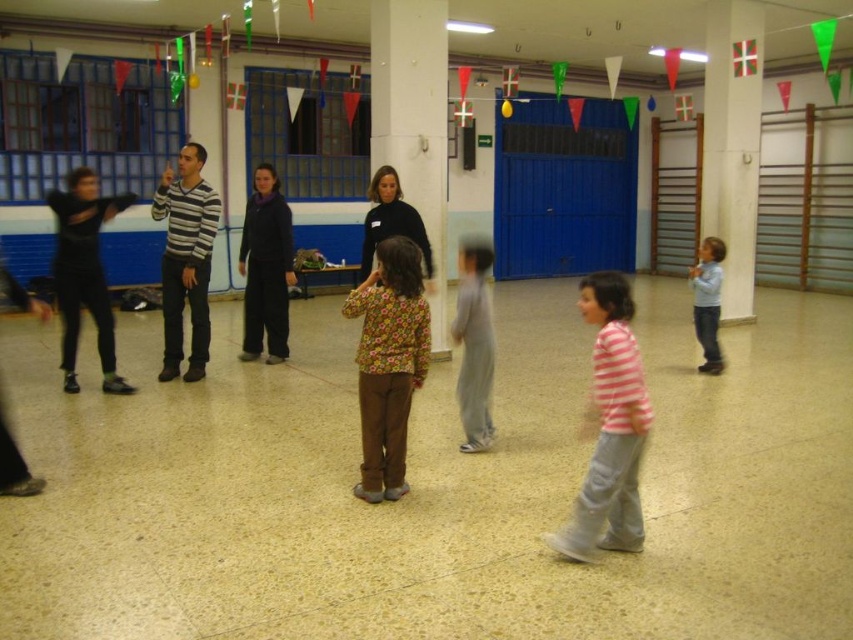
Is point (183, 150) positioned before point (697, 300)?

Yes, it is in front of point (697, 300).

In the scene shown: Which of these two, striped sweater at center or light blue cotton shirt at right, stands shorter?

Standing shorter between the two is light blue cotton shirt at right.

Between point (161, 304) and point (700, 252), which one is positioned behind?

The point (161, 304) is more distant.

Where is `striped sweater at center`? This screenshot has width=853, height=640. striped sweater at center is located at coordinates (186, 259).

Consider the image. Is white concrete pillar at right shorter than gray cotton pants at center?

Incorrect, white concrete pillar at right's height does not fall short of gray cotton pants at center's.

Does point (741, 179) lie in front of point (482, 349)?

No, it is not.

Is point (755, 24) in front of point (479, 333)?

No, it is behind (479, 333).

Where is `white concrete pillar at right`? This screenshot has height=640, width=853. white concrete pillar at right is located at coordinates (732, 144).

Does white glossy pillar at center appear on the right side of black matte pants at left?

Yes, white glossy pillar at center is to the right of black matte pants at left.

Can you confirm if white glossy pillar at center is smaller than black matte pants at left?

Actually, white glossy pillar at center might be larger than black matte pants at left.

Does point (416, 13) come in front of point (73, 365)?

No, (416, 13) is behind (73, 365).

Identify the location of white glossy pillar at center. (415, 122).